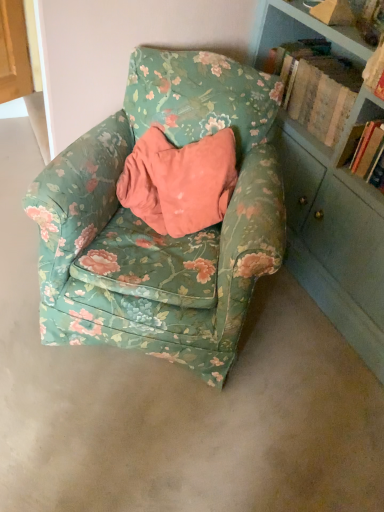
At what (x,y) coordinates should I click in order to perform the action: click on vacant area that is situated to the right of floral fabric armchair at center. Please return your answer as a coordinate pair (x, y). The height and width of the screenshot is (512, 384). Looking at the image, I should click on (303, 357).